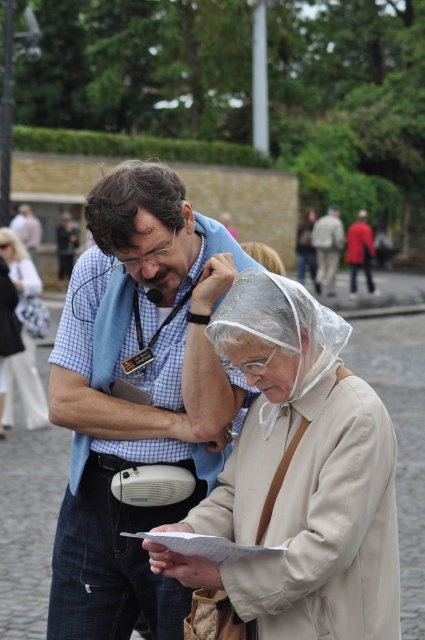
How distant is blue checkered shirt at center from matte white purse at left?

blue checkered shirt at center is 13.17 meters from matte white purse at left.

Does blue checkered shirt at center have a greater width compared to matte white purse at left?

Yes.

At what (x,y) coordinates should I click in order to perform the action: click on blue checkered shirt at center. Please return your answer as a coordinate pair (x, y). This screenshot has height=640, width=425. Looking at the image, I should click on (136, 394).

I want to click on blue checkered shirt at center, so click(x=136, y=394).

In the scene shown: Is matte white purse at left to the left of light beige jacket at center from the viewer's perspective?

Indeed, matte white purse at left is positioned on the left side of light beige jacket at center.

Is matte white purse at left to the right of light beige jacket at center from the viewer's perspective?

In fact, matte white purse at left is to the left of light beige jacket at center.

Describe the element at coordinates (25, 336) in the screenshot. The height and width of the screenshot is (640, 425). I see `matte white purse at left` at that location.

This screenshot has height=640, width=425. Find the location of `matte white purse at left`. matte white purse at left is located at coordinates (25, 336).

Between beige fabric coat at center and matte white purse at left, which one is positioned higher?

beige fabric coat at center

Who is shorter, beige fabric coat at center or matte white purse at left?

matte white purse at left

This screenshot has width=425, height=640. Describe the element at coordinates (299, 477) in the screenshot. I see `beige fabric coat at center` at that location.

This screenshot has width=425, height=640. Find the location of `beige fabric coat at center`. beige fabric coat at center is located at coordinates (299, 477).